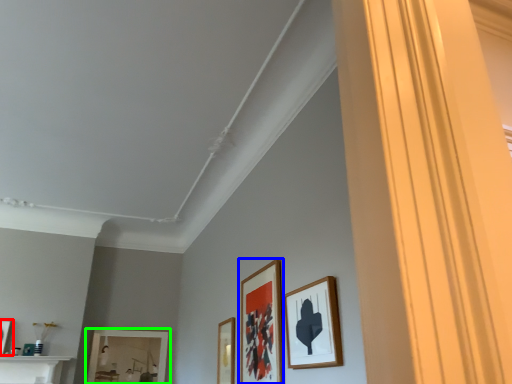
Question: Which object is positioned farthest from picture frame (highlighted by a red box)? Select from picture frame (highlighted by a blue box) and picture frame (highlighted by a green box).

Choices:
 (A) picture frame
 (B) picture frame

Answer: (A)